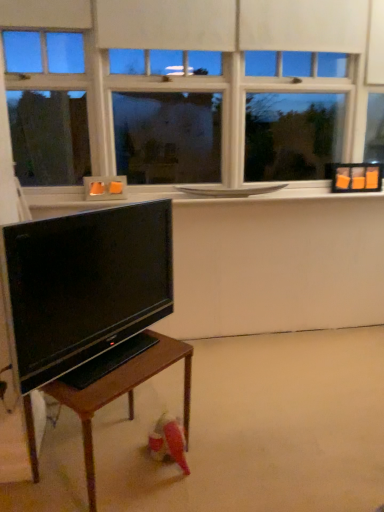
Question: Is white glossy window sill at upper center wider than matte black tv at lower left?

Choices:
 (A) yes
 (B) no

Answer: (A)

Question: Does white glossy window sill at upper center come behind matte black tv at lower left?

Choices:
 (A) no
 (B) yes

Answer: (B)

Question: Is white glossy window sill at upper center bigger than matte black tv at lower left?

Choices:
 (A) no
 (B) yes

Answer: (A)

Question: From the image's perspective, does white glossy window sill at upper center appear lower than matte black tv at lower left?

Choices:
 (A) no
 (B) yes

Answer: (A)

Question: Considering the relative sizes of white glossy window sill at upper center and matte black tv at lower left in the image provided, is white glossy window sill at upper center shorter than matte black tv at lower left?

Choices:
 (A) no
 (B) yes

Answer: (B)

Question: Could you tell me if white glossy window sill at upper center is turned towards matte black tv at lower left?

Choices:
 (A) yes
 (B) no

Answer: (B)

Question: Is matte black tv at lower left not close to white matte window at upper center?

Choices:
 (A) yes
 (B) no

Answer: (A)

Question: From the image's perspective, is matte black tv at lower left under white matte window at upper center?

Choices:
 (A) yes
 (B) no

Answer: (A)

Question: From a real-world perspective, is matte black tv at lower left over white matte window at upper center?

Choices:
 (A) yes
 (B) no

Answer: (B)

Question: Is matte black tv at lower left thinner than white matte window at upper center?

Choices:
 (A) yes
 (B) no

Answer: (A)

Question: Is matte black tv at lower left at the left side of white matte window at upper center?

Choices:
 (A) yes
 (B) no

Answer: (A)

Question: Does matte black tv at lower left have a smaller size compared to white matte window at upper center?

Choices:
 (A) no
 (B) yes

Answer: (B)

Question: Could you tell me if white matte window at upper center is turned towards matte black tv at lower left?

Choices:
 (A) no
 (B) yes

Answer: (B)